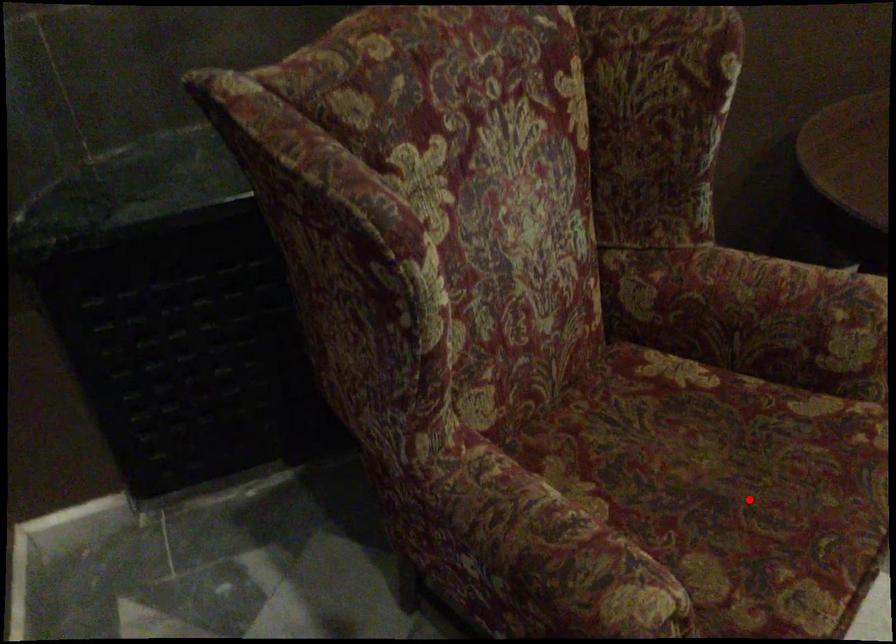
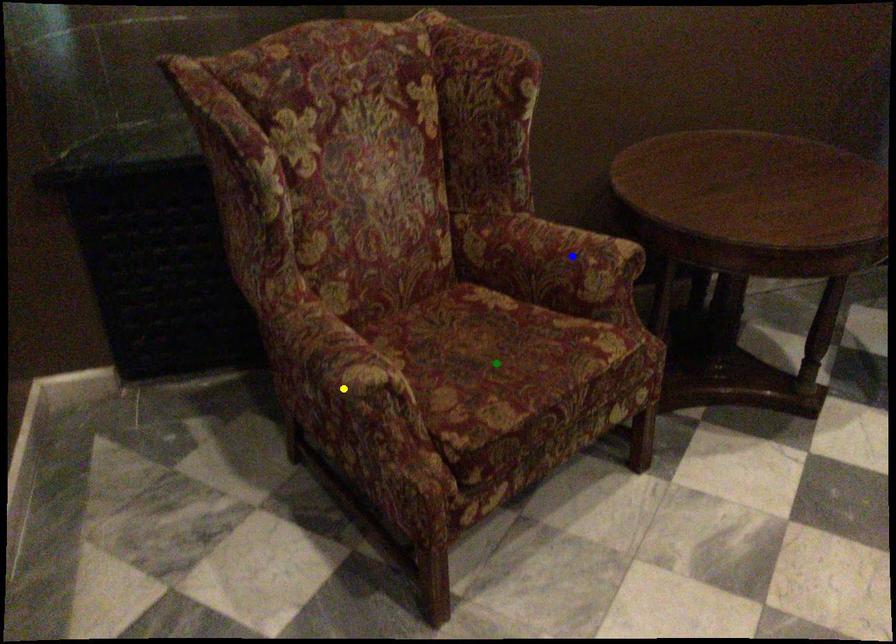
Question: I am providing you with two images of the same scene from different viewpoints. A red point is marked on the first image. You are given multiple points on the second image. Which mark in image 2 goes with the point in image 1?

Choices:
 (A) green point
 (B) yellow point
 (C) blue point

Answer: (A)